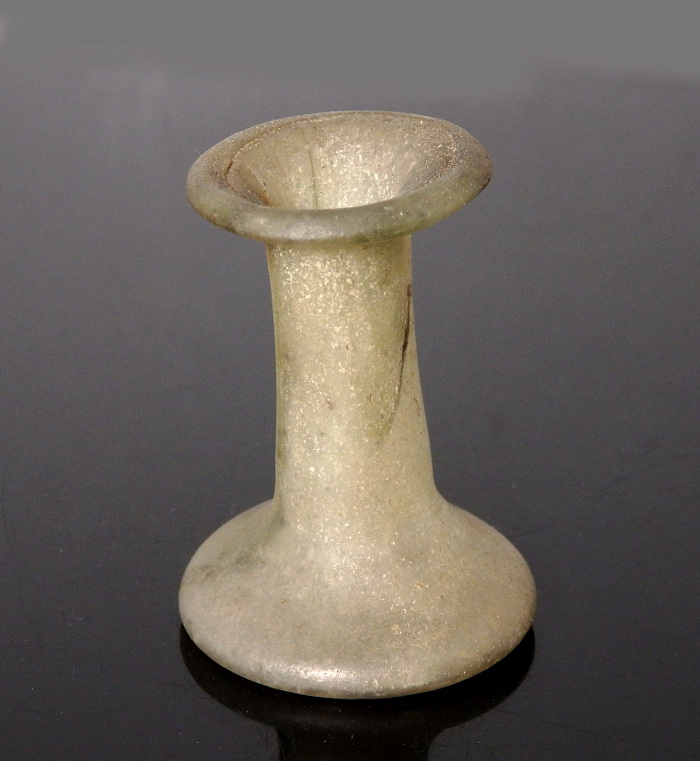
At what (x,y) coordinates should I click in order to perform the action: click on black table halfway up from bottom. Please return your answer as a coordinate pair (x, y). Looking at the image, I should click on (178, 425), (40, 435), (69, 737), (143, 715), (554, 734), (640, 695), (679, 549), (659, 435), (518, 435).